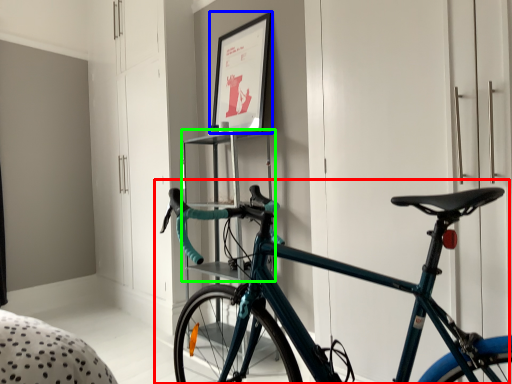
Question: Estimate the real-world distances between objects in this image. Which object is farther from bicycle (highlighted by a red box), picture frame (highlighted by a blue box) or shelf (highlighted by a green box)?

Choices:
 (A) picture frame
 (B) shelf

Answer: (A)